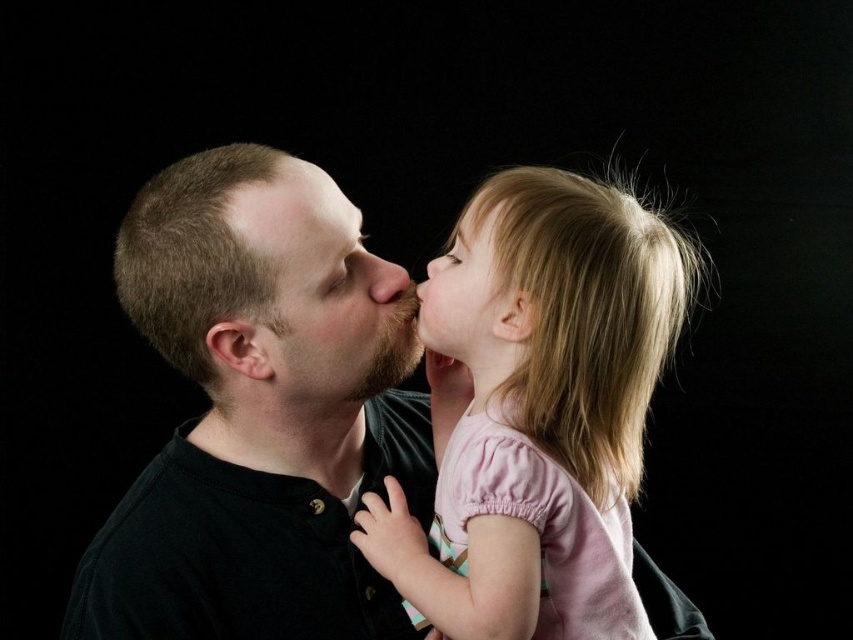
Question: Which object is farther from the camera taking this photo?

Choices:
 (A) smooth skin at upper center
 (B) matte brown nose at center
 (C) pink fabric face at center
 (D) brown matte beard at center

Answer: (B)

Question: Is pink fabric face at center thinner than matte brown nose at center?

Choices:
 (A) yes
 (B) no

Answer: (B)

Question: Can you confirm if pink fabric at center is bigger than matte brown nose at center?

Choices:
 (A) no
 (B) yes

Answer: (B)

Question: Among these objects, which one is farthest from the camera?

Choices:
 (A) pink fabric at center
 (B) pink fabric face at center
 (C) matte brown nose at center

Answer: (C)

Question: Can you confirm if pink fabric at center is thinner than pink fabric face at center?

Choices:
 (A) no
 (B) yes

Answer: (A)

Question: Among these points, which one is farthest from the camera?

Choices:
 (A) (430, 275)
 (B) (392, 275)
 (C) (281, 368)
 (D) (349, 212)

Answer: (B)